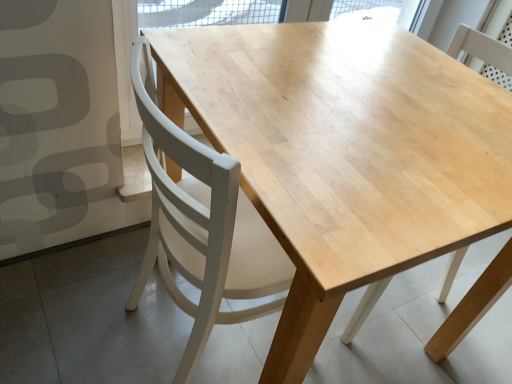
Where is `free location to the left of white wood chair at center, arranged as the first chair when viewed from the left`? free location to the left of white wood chair at center, arranged as the first chair when viewed from the left is located at coordinates pyautogui.click(x=76, y=299).